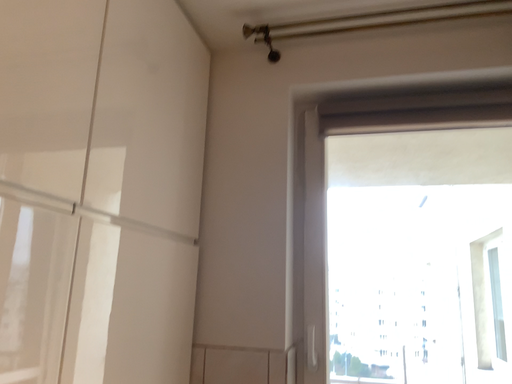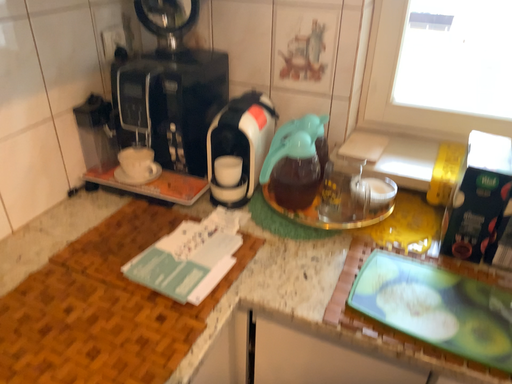
Question: Which way did the camera rotate in the video?

Choices:
 (A) rotated downward
 (B) rotated upward

Answer: (A)